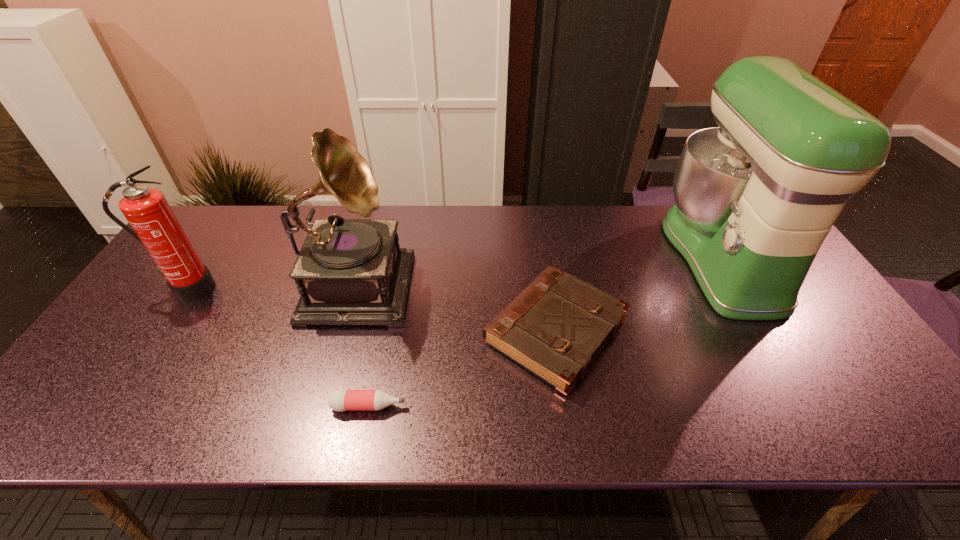
In order to click on free spot at the far edge of the desktop in this screenshot , I will do `click(318, 206)`.

This screenshot has width=960, height=540. I want to click on vacant area at the near edge of the desktop, so click(140, 427).

In the image, there is a desktop. Identify the location of free space at the left edge. (79, 379).

Locate an element on the screen. The width and height of the screenshot is (960, 540). free space at the right edge of the desktop is located at coordinates (839, 347).

Identify the location of free space at the near left corner of the desktop. This screenshot has height=540, width=960. (79, 419).

At what (x,y) coordinates should I click in order to perform the action: click on free point between the mixer and the record player. Please return your answer as a coordinate pair (x, y). Looking at the image, I should click on (539, 268).

Locate an element on the screen. The height and width of the screenshot is (540, 960). free spot between the fourth tallest object and the shortest object is located at coordinates (462, 369).

Find the location of a particular element. This screenshot has width=960, height=540. vacant point located between the fourth object from left to right and the record player is located at coordinates (457, 306).

Locate an element on the screen. The width and height of the screenshot is (960, 540). free spot between the fire extinguisher and the shortest object is located at coordinates (278, 347).

Identify the location of unoccupied position between the hardback book and the mixer. The image size is (960, 540). tap(638, 294).